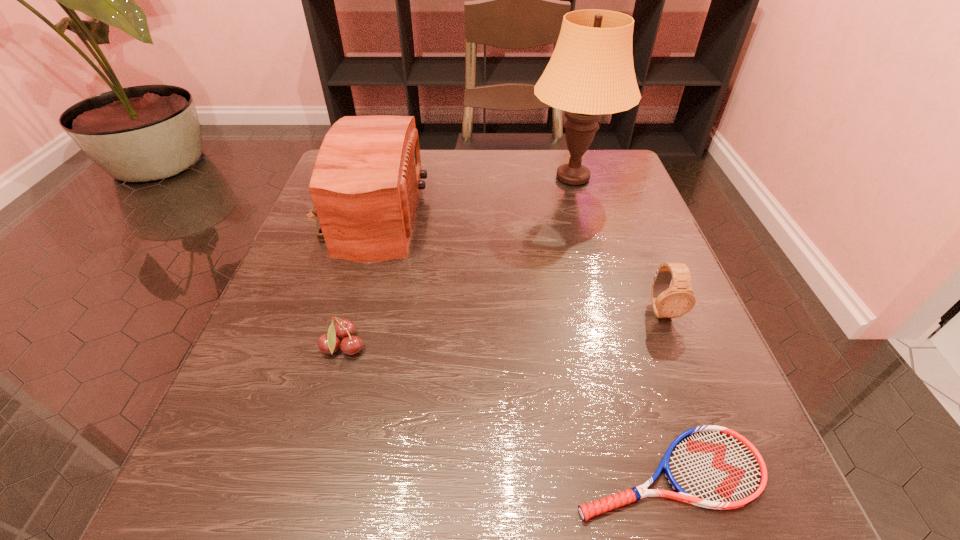
Find the location of a particular element. The image size is (960, 540). lampshade is located at coordinates (591, 72).

Find the location of a particular element. the second tallest object is located at coordinates (365, 183).

I want to click on the third nearest object, so click(x=668, y=302).

Locate an element on the screen. Image resolution: width=960 pixels, height=540 pixels. watch is located at coordinates (668, 302).

Where is `cherry`? Image resolution: width=960 pixels, height=540 pixels. cherry is located at coordinates (344, 329).

Where is `the second shortest object`? the second shortest object is located at coordinates (344, 329).

What are the coordinates of `the nearest object` in the screenshot? It's located at (714, 467).

The width and height of the screenshot is (960, 540). I want to click on the shortest object, so click(x=714, y=467).

Where is `vacant area situated 0.200m on the left of the lampshade`? vacant area situated 0.200m on the left of the lampshade is located at coordinates (442, 178).

This screenshot has height=540, width=960. In order to click on vacant space situated on the front-facing side of the fourth shortest object in this screenshot , I will do `click(539, 215)`.